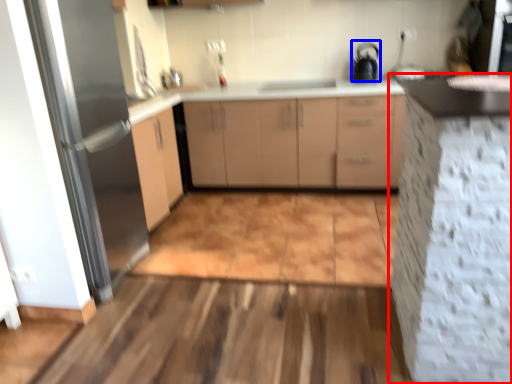
Question: Which point is closer to the camera, cabinetry (highlighted by a red box) or appliance (highlighted by a blue box)?

Choices:
 (A) cabinetry
 (B) appliance

Answer: (A)